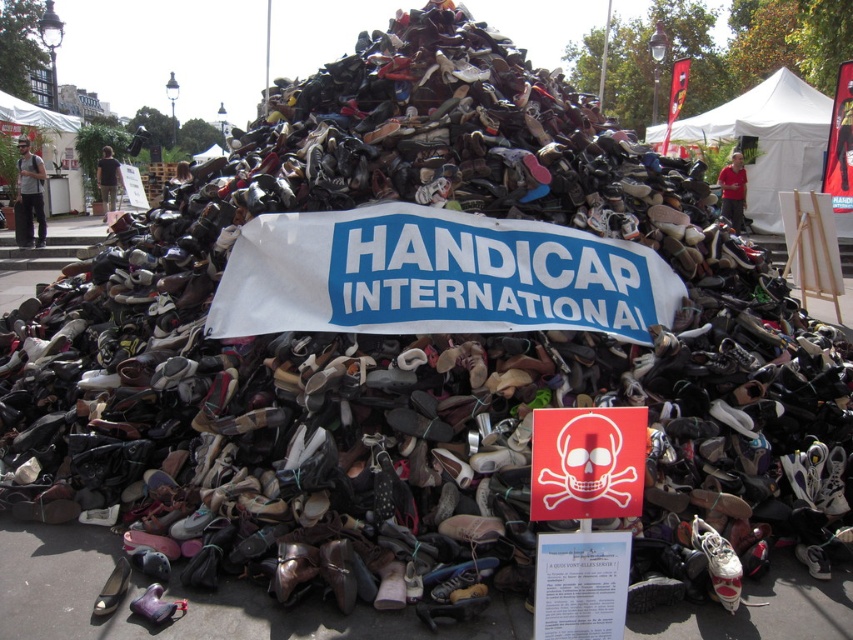
Does red skull sign at center have a greater height compared to white matte shoe at center?

Correct, red skull sign at center is much taller as white matte shoe at center.

Does red skull sign at center have a smaller size compared to white matte shoe at center?

No.

Find the location of a particular element. red skull sign at center is located at coordinates (587, 461).

Does point (579, 538) come behind point (728, 573)?

No.

In the scene shown: Does white paper at center appear under white matte shoe at center?

Actually, white paper at center is above white matte shoe at center.

Does point (595, 570) come closer to viewer compared to point (701, 531)?

Yes, it is in front of point (701, 531).

This screenshot has height=640, width=853. What are the coordinates of `white paper at center` in the screenshot? It's located at pos(581,584).

Is white matte shoe at center closer to the viewer compared to shiny metallic shoe at lower left?

No, white matte shoe at center is further to the viewer.

Can you confirm if white matte shoe at center is positioned above shiny metallic shoe at lower left?

Correct, white matte shoe at center is located above shiny metallic shoe at lower left.

Locate an element on the screen. white matte shoe at center is located at coordinates point(718,563).

I want to click on white matte shoe at center, so click(718, 563).